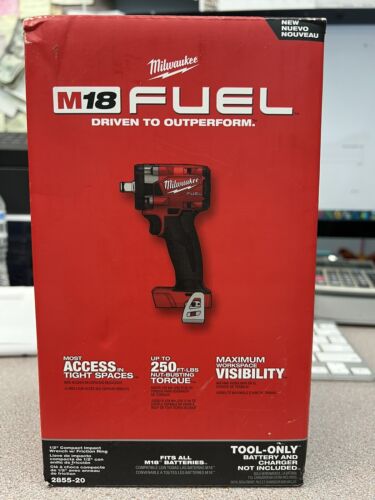
Identify the location of computer monitor. The width and height of the screenshot is (375, 500). click(x=346, y=107).